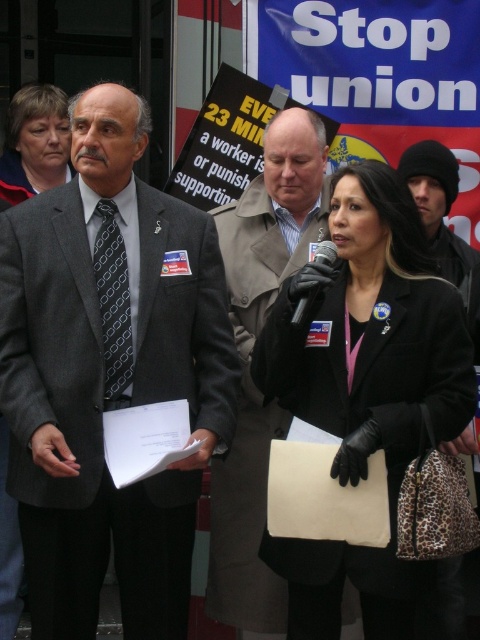
Question: Does matte gray coat at upper left appear under black plastic microphone at center?

Choices:
 (A) no
 (B) yes

Answer: (A)

Question: Which of the following is the closest to the observer?

Choices:
 (A) black plastic microphone at center
 (B) gray textured suit at center

Answer: (B)

Question: Is dark gray textured tie at center positioned in front of black plastic microphone at center?

Choices:
 (A) no
 (B) yes

Answer: (A)

Question: Which of these objects is positioned closest to the light brown leather coat at center?

Choices:
 (A) black woolen hat at upper right
 (B) black leather jacket at center
 (C) black plastic microphone at center
 (D) dark gray textured tie at center

Answer: (C)

Question: Which object is farther from the camera taking this photo?

Choices:
 (A) dark gray textured tie at center
 (B) black leather jacket at center

Answer: (A)

Question: Can you confirm if matte gray coat at upper left is positioned to the left of black woolen hat at upper right?

Choices:
 (A) no
 (B) yes

Answer: (B)